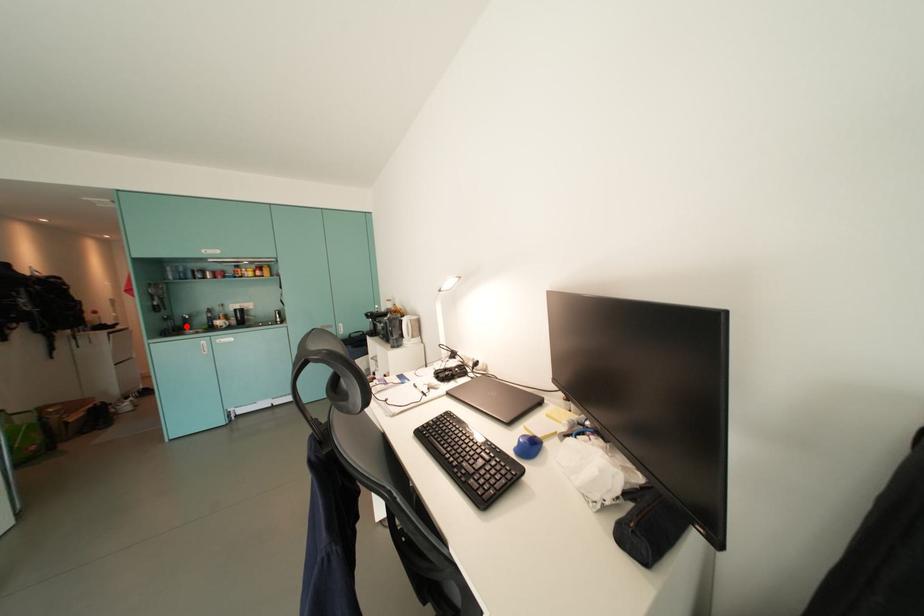
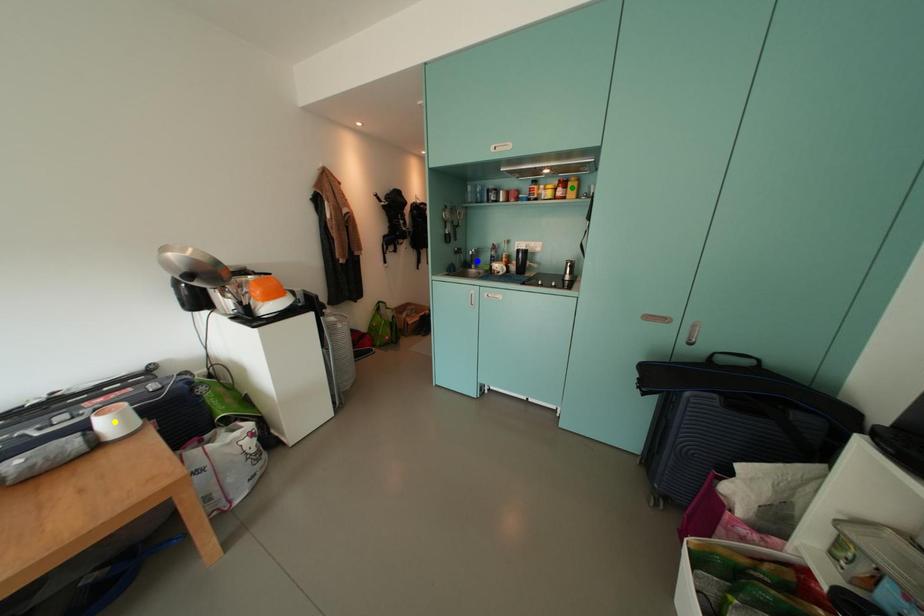
Question: I am providing you with two images of the same scene from different viewpoints. A red point is marked on the first image. You are given multiple points on the second image. In image 2, which mark is for the same physical point as the one in image 1?

Choices:
 (A) yellow point
 (B) green point
 (C) blue point

Answer: (C)